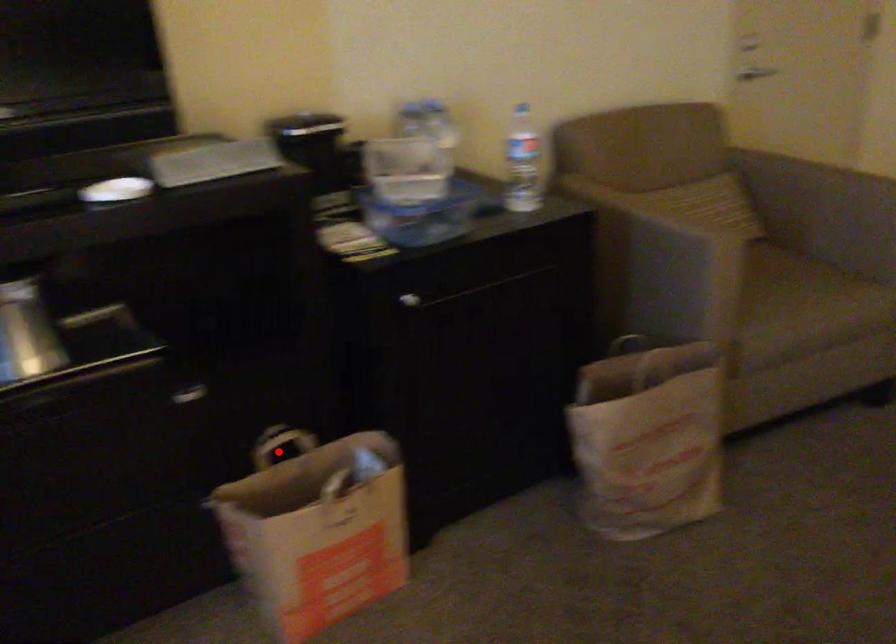
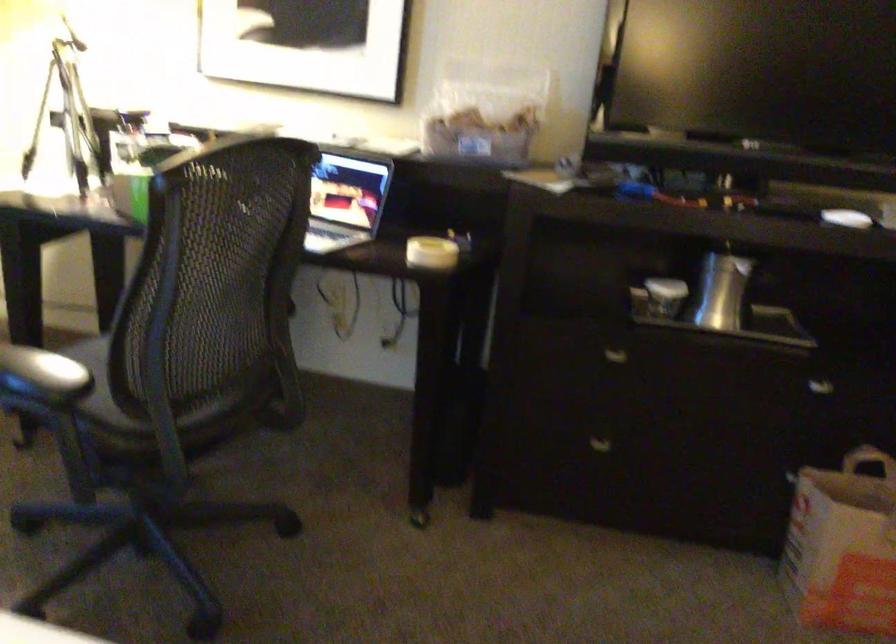
Question: I am providing you with two images of the same scene from different viewpoints. Image1 has a red point marked. In image2, the corresponding 3D location appears at what relative position? Reply with the corresponding letter.

Choices:
 (A) Closer
 (B) Farther

Answer: (B)